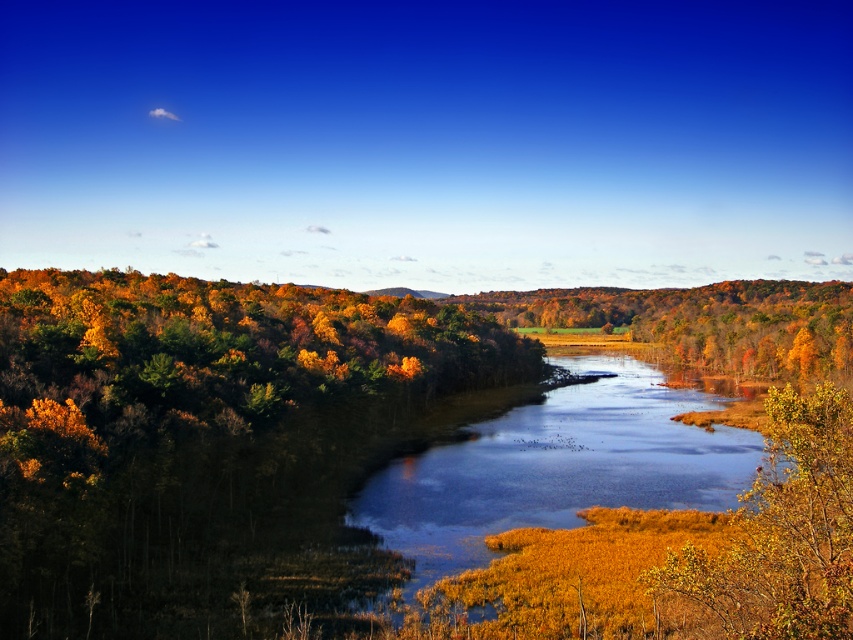
Does golden grassy river at center have a greater width compared to golden textured leaves at lower right?

Yes.

Does golden grassy river at center have a greater height compared to golden textured leaves at lower right?

In fact, golden grassy river at center may be shorter than golden textured leaves at lower right.

Find the location of `golden grassy river at center`. golden grassy river at center is located at coordinates (556, 467).

The image size is (853, 640). In order to click on golden grassy river at center in this screenshot , I will do `click(556, 467)`.